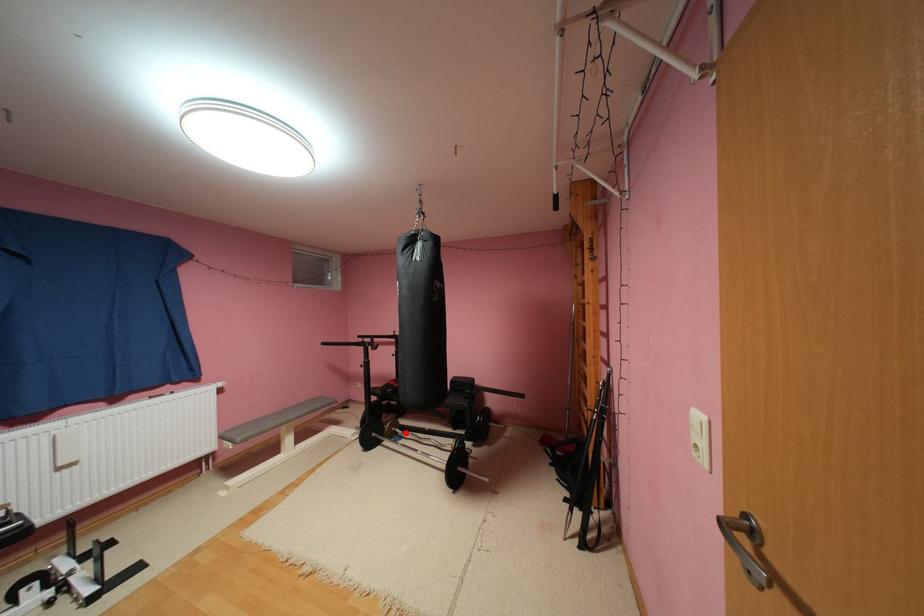
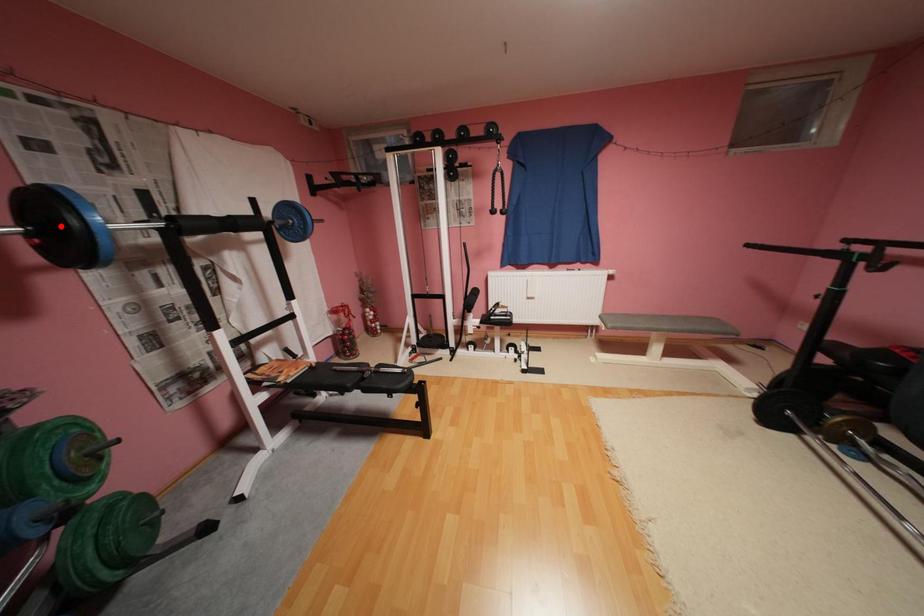
I am providing you with two images of the same scene from different viewpoints. A red point is marked on the first image and another point is marked on the second image. Is the marked point in image1 the same physical position as the marked point in image2?

No